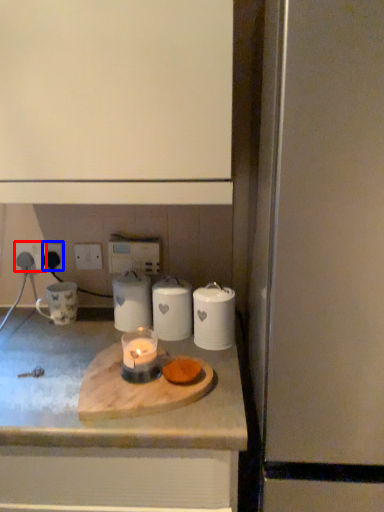
Question: Which point is closer to the camera, electric outlet (highlighted by a red box) or electric outlet (highlighted by a blue box)?

Choices:
 (A) electric outlet
 (B) electric outlet

Answer: (B)